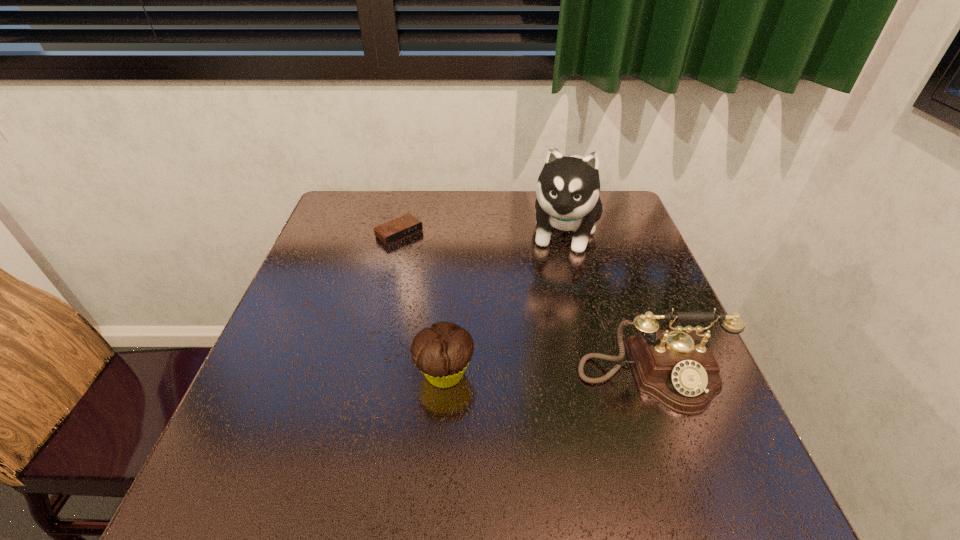
Where is `the third object from right to left`? The width and height of the screenshot is (960, 540). the third object from right to left is located at coordinates (442, 353).

In order to click on muffin in this screenshot , I will do `click(442, 353)`.

The height and width of the screenshot is (540, 960). I want to click on telephone, so click(x=676, y=367).

The image size is (960, 540). I want to click on the leftmost object, so click(402, 227).

This screenshot has height=540, width=960. What are the coordinates of `alarm clock` in the screenshot? It's located at (402, 227).

Identify the location of puppy. (568, 188).

Find the location of `blank area located 0.360m on the right of the muffin`. blank area located 0.360m on the right of the muffin is located at coordinates (655, 374).

Identify the location of free point located 0.070m on the dial of the telephone. The image size is (960, 540). (678, 452).

In order to click on vacant point located 0.280m on the front face of the leftmost object in this screenshot , I will do `click(477, 298)`.

Where is `vacant space situated on the front face of the leftmost object`? The height and width of the screenshot is (540, 960). vacant space situated on the front face of the leftmost object is located at coordinates (443, 269).